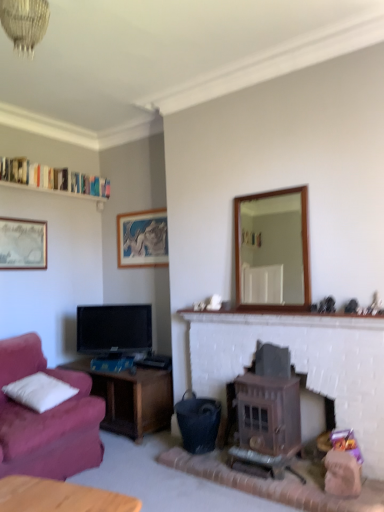
What are the coordinates of `empty space that is ontop of wooden-framed mirror at center-right (from a real-world perspective)` in the screenshot? It's located at (274, 184).